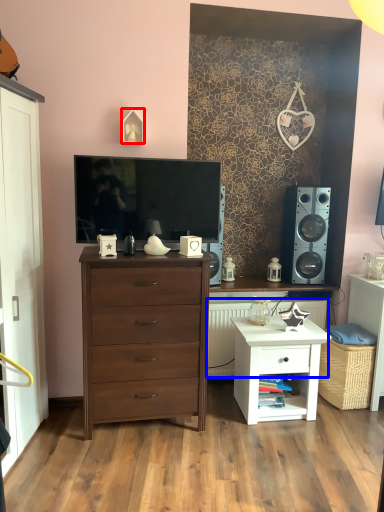
Question: Which object appears closest to the camera in this image, picture frame (highlighted by a red box) or radiator (highlighted by a blue box)?

Choices:
 (A) picture frame
 (B) radiator

Answer: (A)